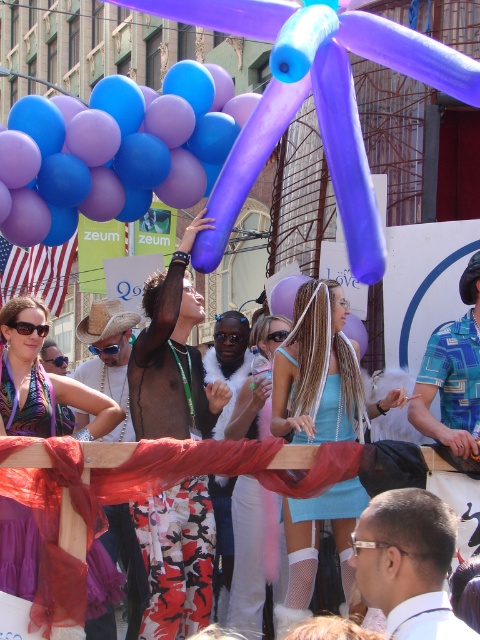
You are taking a photo of the parade scene and want to focus on both the point at coordinates point [425,595] and point [444,372]. Which point should you adjust your focus to first to ensure both are in clear view?

You should focus on point [425,595] first because it is closer to the camera than point [444,372], allowing both points to be in focus when using depth of field.

From the picture: You are standing in the crowd at the festival and notice the lavender rubber balloon at upper center. Where exactly is it positioned in relation to the central person holding the balloon sculpture?

The lavender rubber balloon at upper center is located at coordinates point (113,150), which places it slightly to the upper left relative to the central person holding the balloon sculpture.

Looking at this image, you are a photographer at the festival and want to capture a photo where the lavender rubber balloon at upper center is clearly visible above the light blue fabric dress at center. Based on their positions, is this possible?

Yes, the lavender rubber balloon at upper center is positioned over the light blue fabric dress at center, so it will naturally appear above it in the photo.